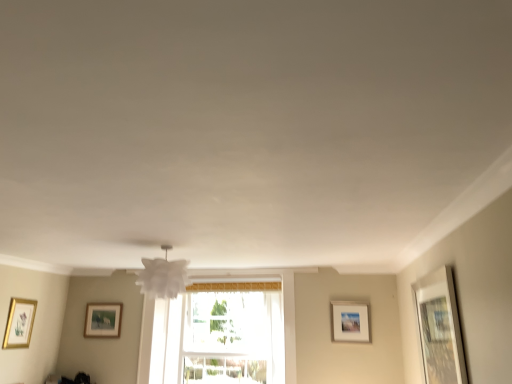
Describe the element at coordinates (439, 328) in the screenshot. The width and height of the screenshot is (512, 384). I see `wooden picture frame at right, the 1th picture frame when ordered from right to left` at that location.

At what (x,y) coordinates should I click in order to perform the action: click on matte wooden picture frame at lower left, which is the 4th picture frame in front-to-back order. Please return your answer as a coordinate pair (x, y). Looking at the image, I should click on (103, 320).

This screenshot has width=512, height=384. I want to click on white paper lampshade at center, so click(x=163, y=276).

At what (x,y) coordinates should I click in order to perform the action: click on white matte picture frame at upper right, placed as the 3th picture frame when sorted from left to right. Please return your answer as a coordinate pair (x, y). Looking at the image, I should click on (350, 322).

You are a GUI agent. You are given a task and a screenshot of the screen. Output one action in this format:
    pyautogui.click(x=<x>, y=<y>)
    Task: Click on the wooden picture frame at right, which ranks as the 1th picture frame in front-to-back order
    The image size is (512, 384).
    Given the screenshot: What is the action you would take?
    pyautogui.click(x=439, y=328)

Is white paper lampshade at center looking in the opposite direction of wooden picture frame at right, the 1th picture frame when ordered from right to left?

No.

Is point (160, 295) closer or farther from the camera than point (447, 350)?

Point (160, 295) appears to be farther away from the viewer than point (447, 350).

Is white paper lampshade at center positioned beyond the bounds of wooden picture frame at right, marked as the 4th picture frame in a back-to-front arrangement?

Absolutely, white paper lampshade at center is external to wooden picture frame at right, marked as the 4th picture frame in a back-to-front arrangement.

Is the position of white paper lampshade at center more distant than that of wooden picture frame at right, which ranks as the 1th picture frame in front-to-back order?

Yes, white paper lampshade at center is further from the viewer.

Who is more distant, transparent glass window at center or matte wooden picture frame at lower left, which is the 2th picture frame from left to right?

matte wooden picture frame at lower left, which is the 2th picture frame from left to right, is further from the camera.

From the image's perspective, would you say transparent glass window at center is shown under matte wooden picture frame at lower left, the third picture frame positioned from the right?

Yes, from the image's perspective, transparent glass window at center is beneath matte wooden picture frame at lower left, the third picture frame positioned from the right.

Is transparent glass window at center to the left of matte wooden picture frame at lower left, which is the 4th picture frame in front-to-back order, from the viewer's perspective?

No.

Is the surface of white paper lampshade at center in direct contact with white matte picture frame at upper right, the second picture frame in the back-to-front sequence?

No.

Considering the positions of objects white paper lampshade at center and white matte picture frame at upper right, the 3th picture frame positioned from the front, in the image provided, who is behind, white paper lampshade at center or white matte picture frame at upper right, the 3th picture frame positioned from the front,?

white matte picture frame at upper right, the 3th picture frame positioned from the front, is more distant.

Based on the photo, considering the relative positions of white paper lampshade at center and white matte picture frame at upper right, placed as the 3th picture frame when sorted from left to right, in the image provided, is white paper lampshade at center to the right of white matte picture frame at upper right, placed as the 3th picture frame when sorted from left to right, from the viewer's perspective?

No.

From a real-world perspective, who is located lower, white paper lampshade at center or white matte picture frame at upper right, the 3th picture frame positioned from the front?

white matte picture frame at upper right, the 3th picture frame positioned from the front, from a real-world perspective.

Between gold-framed picture at left, the 4th picture frame from the right, and white matte picture frame at upper right, the 3th picture frame positioned from the front, which one appears on the right side from the viewer's perspective?

From the viewer's perspective, white matte picture frame at upper right, the 3th picture frame positioned from the front, appears more on the right side.

How distant is gold-framed picture at left, which appears as the second picture frame when viewed from the front, from white matte picture frame at upper right, the second picture frame in the back-to-front sequence?

2.87 meters.

Based on the photo, is gold-framed picture at left, the third picture frame viewed from the back, closer to camera compared to white matte picture frame at upper right, the 2th picture frame when ordered from right to left?

Yes, gold-framed picture at left, the third picture frame viewed from the back, is closer to the camera.

Could you tell me if white matte picture frame at upper right, the 2th picture frame when ordered from right to left, is turned towards matte wooden picture frame at lower left, which is the 4th picture frame in front-to-back order?

No.

Where is `the 1st picture frame in front of the matte wooden picture frame at lower left, which is the 2th picture frame from left to right, counting from the anchor's position`? Image resolution: width=512 pixels, height=384 pixels. the 1st picture frame in front of the matte wooden picture frame at lower left, which is the 2th picture frame from left to right, counting from the anchor's position is located at coordinates (350, 322).

Is point (367, 329) positioned before point (114, 307)?

That is True.

Would you say white matte picture frame at upper right, the 3th picture frame positioned from the front, is outside matte wooden picture frame at lower left, which is the 4th picture frame in front-to-back order?

white matte picture frame at upper right, the 3th picture frame positioned from the front, lies outside matte wooden picture frame at lower left, which is the 4th picture frame in front-to-back order,'s area.

Consider the image. Is matte wooden picture frame at lower left, which is the 2th picture frame from left to right, surrounded by wooden picture frame at right, which ranks as the 1th picture frame in front-to-back order?

That's incorrect, matte wooden picture frame at lower left, which is the 2th picture frame from left to right, is not inside wooden picture frame at right, which ranks as the 1th picture frame in front-to-back order.

Which object is wider, wooden picture frame at right, marked as the 4th picture frame in a back-to-front arrangement, or matte wooden picture frame at lower left, the third picture frame positioned from the right?

wooden picture frame at right, marked as the 4th picture frame in a back-to-front arrangement.

From the image's perspective, relative to matte wooden picture frame at lower left, the first picture frame from the back, is wooden picture frame at right, marked as the 4th picture frame in a back-to-front arrangement, above or below?

Based on their image positions, wooden picture frame at right, marked as the 4th picture frame in a back-to-front arrangement, is located above matte wooden picture frame at lower left, the first picture frame from the back.

Which point is more forward, (429, 383) or (109, 322)?

The point (429, 383) is more forward.

Does white paper lampshade at center have a smaller size compared to gold-framed picture at left, the 1th picture frame in the left-to-right sequence?

Incorrect, white paper lampshade at center is not smaller in size than gold-framed picture at left, the 1th picture frame in the left-to-right sequence.

Can you confirm if white paper lampshade at center is positioned to the left of gold-framed picture at left, the 1th picture frame in the left-to-right sequence?

No, white paper lampshade at center is not to the left of gold-framed picture at left, the 1th picture frame in the left-to-right sequence.

From a real-world perspective, who is located higher, white paper lampshade at center or gold-framed picture at left, the 4th picture frame from the right?

white paper lampshade at center is physically above.

From the image's perspective, which object appears higher, white paper lampshade at center or gold-framed picture at left, the 4th picture frame from the right?

From the image's view, white paper lampshade at center is above.

I want to click on picture frame in front of the white paper lampshade at center, so click(439, 328).

Where is `window below the matte wooden picture frame at lower left, which is the 4th picture frame in front-to-back order (from the image's perspective)`? The image size is (512, 384). window below the matte wooden picture frame at lower left, which is the 4th picture frame in front-to-back order (from the image's perspective) is located at coordinates (219, 337).

Looking at this image, from the image, which object appears to be nearer to matte wooden picture frame at lower left, the first picture frame from the back, white matte picture frame at upper right, the second picture frame in the back-to-front sequence, or gold-framed picture at left, the 1th picture frame in the left-to-right sequence?

gold-framed picture at left, the 1th picture frame in the left-to-right sequence, lies closer to matte wooden picture frame at lower left, the first picture frame from the back, than the other object.

Considering their positions, is wooden picture frame at right, marked as the 4th picture frame in a back-to-front arrangement, positioned further to transparent glass window at center than white paper lampshade at center?

wooden picture frame at right, marked as the 4th picture frame in a back-to-front arrangement, is further to transparent glass window at center.

Which object lies nearer to the anchor point wooden picture frame at right, placed as the fourth picture frame when sorted from left to right, matte wooden picture frame at lower left, the first picture frame from the back, or white paper lampshade at center?

Based on the image, white paper lampshade at center appears to be nearer to wooden picture frame at right, placed as the fourth picture frame when sorted from left to right.

Which object lies nearer to the anchor point wooden picture frame at right, placed as the fourth picture frame when sorted from left to right, transparent glass window at center or white paper lampshade at center?

white paper lampshade at center is closer to wooden picture frame at right, placed as the fourth picture frame when sorted from left to right.

Looking at the image, which one is located further to gold-framed picture at left, the third picture frame viewed from the back, white paper lampshade at center or matte wooden picture frame at lower left, the first picture frame from the back?

white paper lampshade at center lies further to gold-framed picture at left, the third picture frame viewed from the back, than the other object.

Based on their spatial positions, is white paper lampshade at center or white matte picture frame at upper right, the second picture frame in the back-to-front sequence, further from gold-framed picture at left, the 1th picture frame in the left-to-right sequence?

white matte picture frame at upper right, the second picture frame in the back-to-front sequence, is positioned further to the anchor gold-framed picture at left, the 1th picture frame in the left-to-right sequence.

Looking at the image, which one is located further to white paper lampshade at center, matte wooden picture frame at lower left, the third picture frame positioned from the right, or white matte picture frame at upper right, the 2th picture frame when ordered from right to left?

The object further to white paper lampshade at center is white matte picture frame at upper right, the 2th picture frame when ordered from right to left.

Which object lies nearer to the anchor point white matte picture frame at upper right, placed as the 3th picture frame when sorted from left to right, wooden picture frame at right, which ranks as the 1th picture frame in front-to-back order, or white paper lampshade at center?

The object closer to white matte picture frame at upper right, placed as the 3th picture frame when sorted from left to right, is wooden picture frame at right, which ranks as the 1th picture frame in front-to-back order.

Where is `lamp between gold-framed picture at left, the third picture frame viewed from the back, and white matte picture frame at upper right, the 3th picture frame positioned from the front, from left to right`? lamp between gold-framed picture at left, the third picture frame viewed from the back, and white matte picture frame at upper right, the 3th picture frame positioned from the front, from left to right is located at coordinates (163, 276).

At what (x,y) coordinates should I click in order to perform the action: click on lamp located between matte wooden picture frame at lower left, the first picture frame from the back, and white matte picture frame at upper right, the 3th picture frame positioned from the front, in the left-right direction. Please return your answer as a coordinate pair (x, y). Looking at the image, I should click on (163, 276).

I want to click on window between white paper lampshade at center and white matte picture frame at upper right, the 3th picture frame positioned from the front, in the horizontal direction, so click(x=219, y=337).

You are a GUI agent. You are given a task and a screenshot of the screen. Output one action in this format:
    pyautogui.click(x=<x>, y=<y>)
    Task: Click on the window between matte wooden picture frame at lower left, which is the 4th picture frame in front-to-back order, and white matte picture frame at upper right, the 2th picture frame when ordered from right to left
    
    Given the screenshot: What is the action you would take?
    pyautogui.click(x=219, y=337)